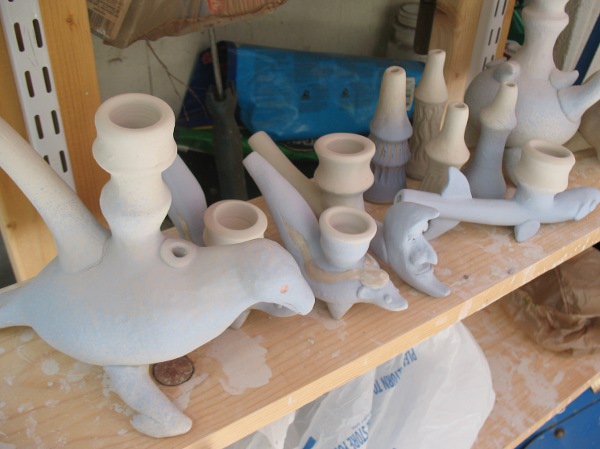
What are the coordinates of `wooden shelf` in the screenshot? It's located at (367, 333), (532, 385).